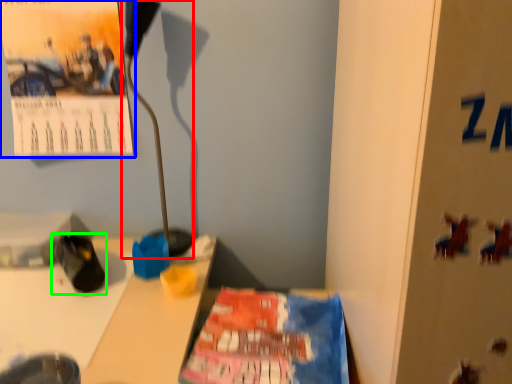
Question: Which object is positioned farthest from lamp (highlighted by a red box)? Select from poster (highlighted by a blue box) and footwear (highlighted by a green box).

Choices:
 (A) poster
 (B) footwear

Answer: (B)